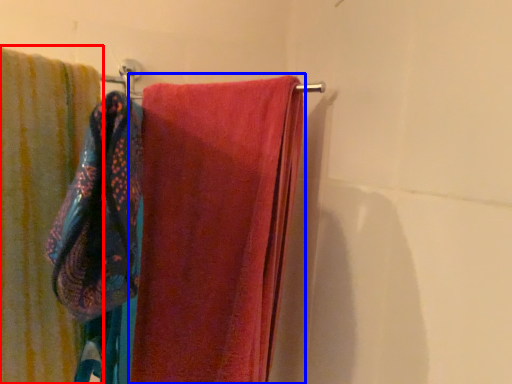
Question: Among these objects, which one is farthest to the camera, towel (highlighted by a red box) or towel (highlighted by a blue box)?

Choices:
 (A) towel
 (B) towel

Answer: (B)